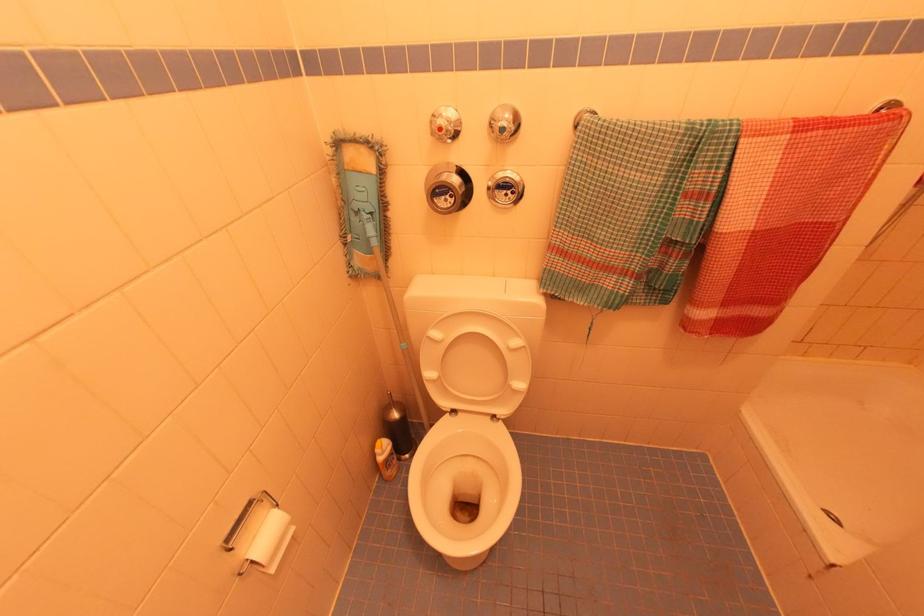
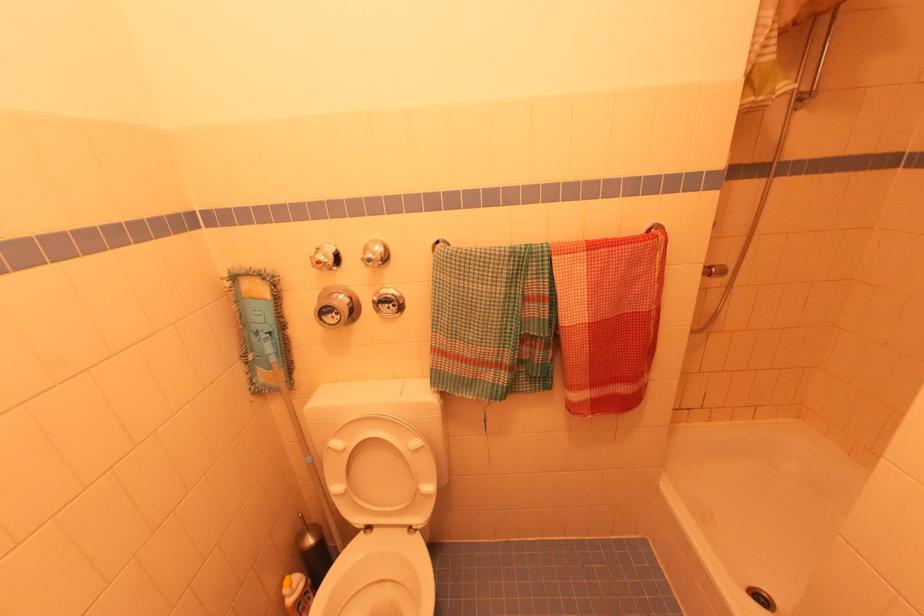
In the second image, find the point that corresponds to the point at 515,193 in the first image.

(395, 306)